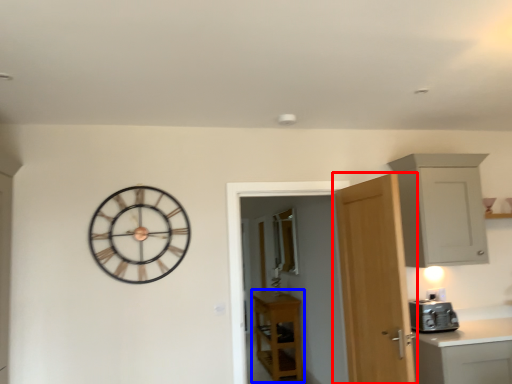
Question: Which object appears farthest to the camera in this image, door (highlighted by a red box) or cabinetry (highlighted by a blue box)?

Choices:
 (A) door
 (B) cabinetry

Answer: (B)